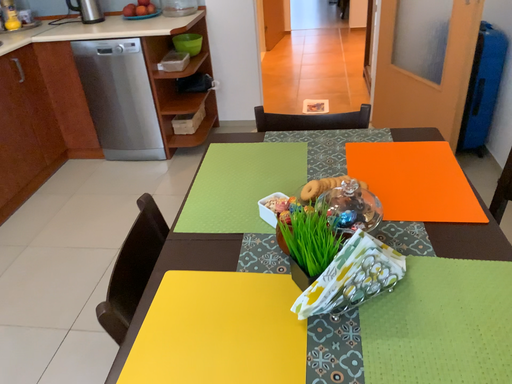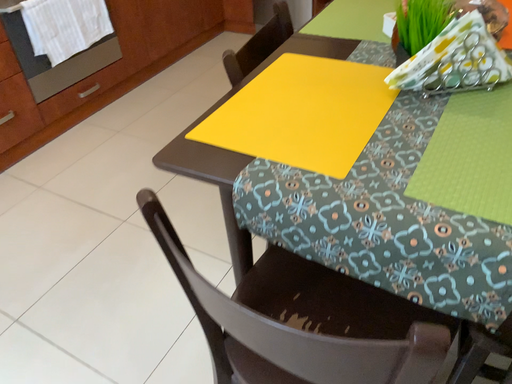
Question: How did the camera likely rotate when shooting the video?

Choices:
 (A) rotated left
 (B) rotated right

Answer: (A)